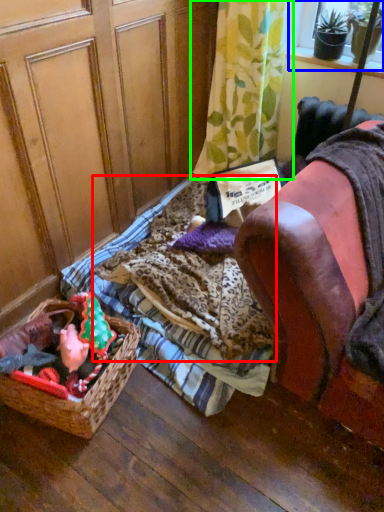
Question: Based on their relative distances, which object is farther from blanket (highlighted by a red box)? Choose from window screen (highlighted by a blue box) and curtain (highlighted by a green box).

Choices:
 (A) window screen
 (B) curtain

Answer: (A)